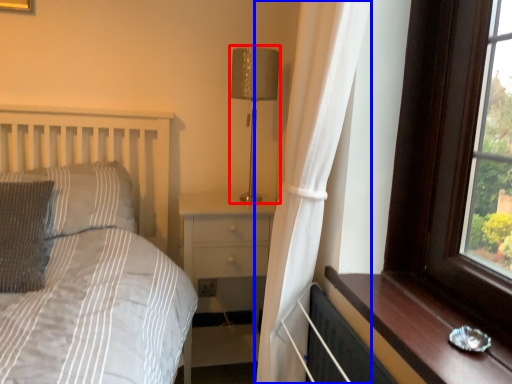
Question: Which object appears closest to the camera in this image, table lamp (highlighted by a red box) or curtain (highlighted by a blue box)?

Choices:
 (A) table lamp
 (B) curtain

Answer: (B)